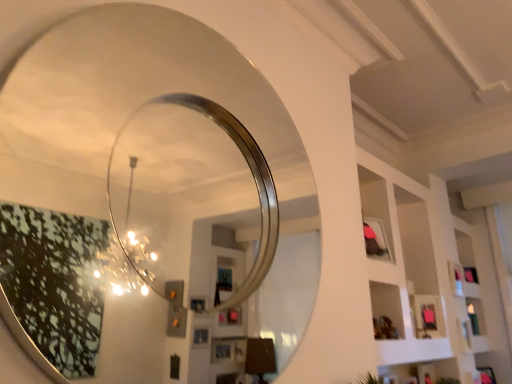
Question: Is polished silver mirror at upper left not close to white matte shelf at upper right?

Choices:
 (A) no
 (B) yes

Answer: (B)

Question: Is polished silver mirror at upper left looking in the opposite direction of white matte shelf at upper right?

Choices:
 (A) no
 (B) yes

Answer: (A)

Question: From the image's perspective, is polished silver mirror at upper left under white matte shelf at upper right?

Choices:
 (A) no
 (B) yes

Answer: (A)

Question: Is polished silver mirror at upper left positioned behind white matte shelf at upper right?

Choices:
 (A) no
 (B) yes

Answer: (A)

Question: Is polished silver mirror at upper left shorter than white matte shelf at upper right?

Choices:
 (A) no
 (B) yes

Answer: (B)

Question: Can you confirm if polished silver mirror at upper left is thinner than white matte shelf at upper right?

Choices:
 (A) no
 (B) yes

Answer: (B)

Question: Is white matte shelf at upper right at the right side of polished silver mirror at upper left?

Choices:
 (A) no
 (B) yes

Answer: (B)

Question: Would you say polished silver mirror at upper left is part of white matte shelf at upper right's contents?

Choices:
 (A) yes
 (B) no

Answer: (B)

Question: Does white matte shelf at upper right have a larger size compared to polished silver mirror at upper left?

Choices:
 (A) yes
 (B) no

Answer: (A)

Question: Can you confirm if white matte shelf at upper right is positioned to the left of polished silver mirror at upper left?

Choices:
 (A) no
 (B) yes

Answer: (A)

Question: From a real-world perspective, does white matte shelf at upper right sit lower than polished silver mirror at upper left?

Choices:
 (A) yes
 (B) no

Answer: (B)

Question: Does white matte shelf at upper right have a greater width compared to polished silver mirror at upper left?

Choices:
 (A) yes
 (B) no

Answer: (A)

Question: Considering the positions of polished silver mirror at upper left and white matte shelf at upper right in the image, is polished silver mirror at upper left taller or shorter than white matte shelf at upper right?

Choices:
 (A) short
 (B) tall

Answer: (A)